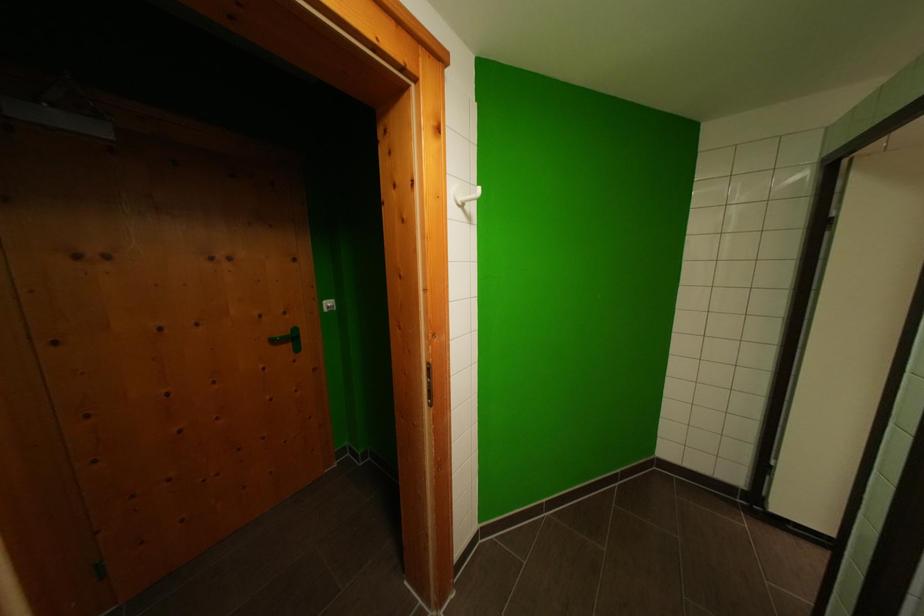
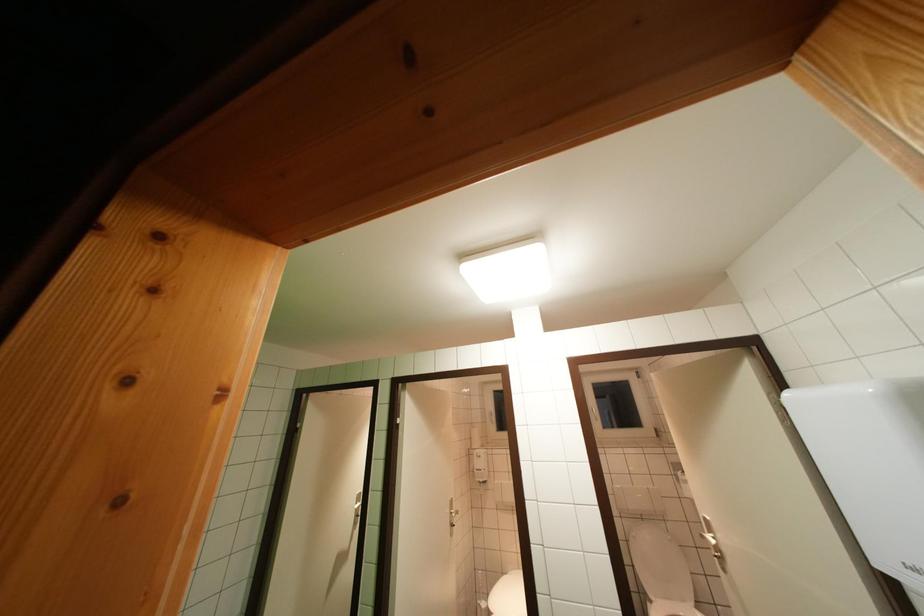
The first image is from the beginning of the video and the second image is from the end. How did the camera likely rotate when shooting the video?

The rotation direction of the camera is right-up.